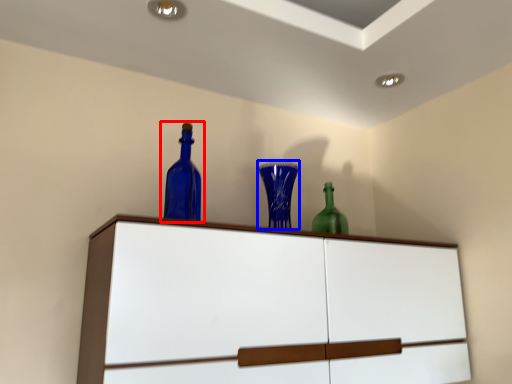
Question: Which of the following is the farthest to the observer, bottle (highlighted by a red box) or glass vase (highlighted by a blue box)?

Choices:
 (A) bottle
 (B) glass vase

Answer: (B)